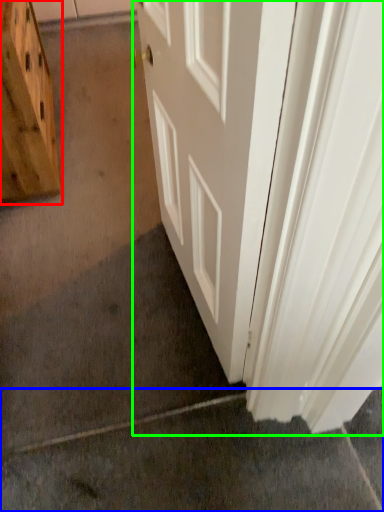
Question: Estimate the real-world distances between objects in this image. Which object is closer to cabinetry (highlighted by a red box), concrete (highlighted by a blue box) or door (highlighted by a green box)?

Choices:
 (A) concrete
 (B) door

Answer: (B)